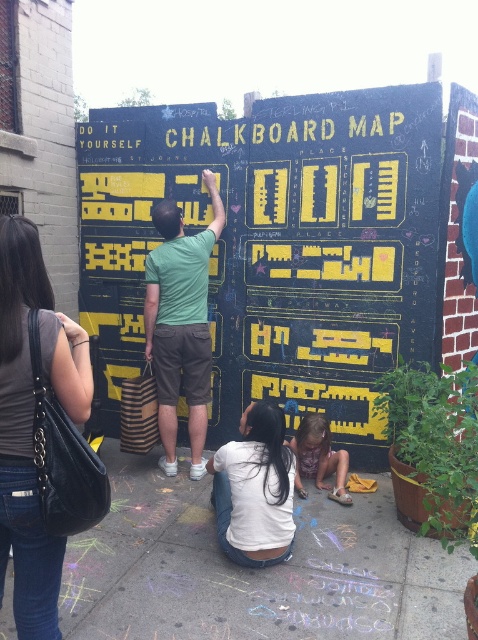
Between point (130, 492) and point (55, 570), which one is positioned in front?

Point (55, 570)

Can you confirm if chalk at lower center is bigger than dark gray leather handbag at lower left?

Yes.

This screenshot has width=478, height=640. What do you see at coordinates (253, 570) in the screenshot?
I see `chalk at lower center` at bounding box center [253, 570].

This screenshot has height=640, width=478. What are the coordinates of `chalk at lower center` in the screenshot? It's located at (253, 570).

Based on the photo, does green matte shirt at center have a lesser height compared to matte purple dress at lower center?

No, green matte shirt at center is not shorter than matte purple dress at lower center.

Measure the distance between point (x=197, y=262) and camera.

Point (x=197, y=262) is 4.36 meters from camera.

Locate an element on the screen. green matte shirt at center is located at coordinates (181, 324).

Who is taller, chalk at lower center or white cotton shirt at lower center?

Standing taller between the two is white cotton shirt at lower center.

Who is positioned more to the left, chalk at lower center or white cotton shirt at lower center?

chalk at lower center

Does point (84, 566) come closer to viewer compared to point (247, 454)?

No, it is behind (247, 454).

Locate an element on the screen. chalk at lower center is located at coordinates (253, 570).